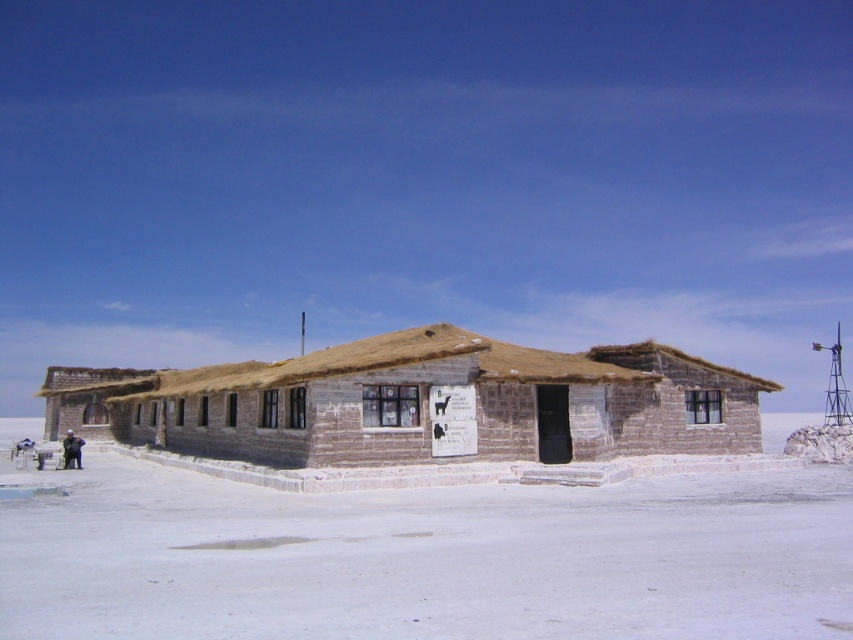
Is the position of rustic wooden hut at center more distant than that of dark blue fabric jacket at lower left?

No, it is in front of dark blue fabric jacket at lower left.

Is point (653, 429) more distant than point (67, 467)?

No, (653, 429) is closer to viewer.

This screenshot has width=853, height=640. I want to click on rustic wooden hut at center, so click(x=422, y=403).

Which is above, white salt flat at center or dark blue fabric jacket at lower left?

white salt flat at center is higher up.

Between white salt flat at center and dark blue fabric jacket at lower left, which one appears on the right side from the viewer's perspective?

white salt flat at center

Describe the element at coordinates (427, 557) in the screenshot. This screenshot has width=853, height=640. I see `white salt flat at center` at that location.

Locate an element on the screen. This screenshot has height=640, width=853. white salt flat at center is located at coordinates (427, 557).

Can you confirm if white salt flat at center is taller than rustic wooden hut at center?

No.

Which of these two, white salt flat at center or rustic wooden hut at center, stands shorter?

white salt flat at center

Does point (114, 634) come in front of point (482, 429)?

Yes, it is.

The height and width of the screenshot is (640, 853). In order to click on white salt flat at center in this screenshot , I will do coord(427,557).